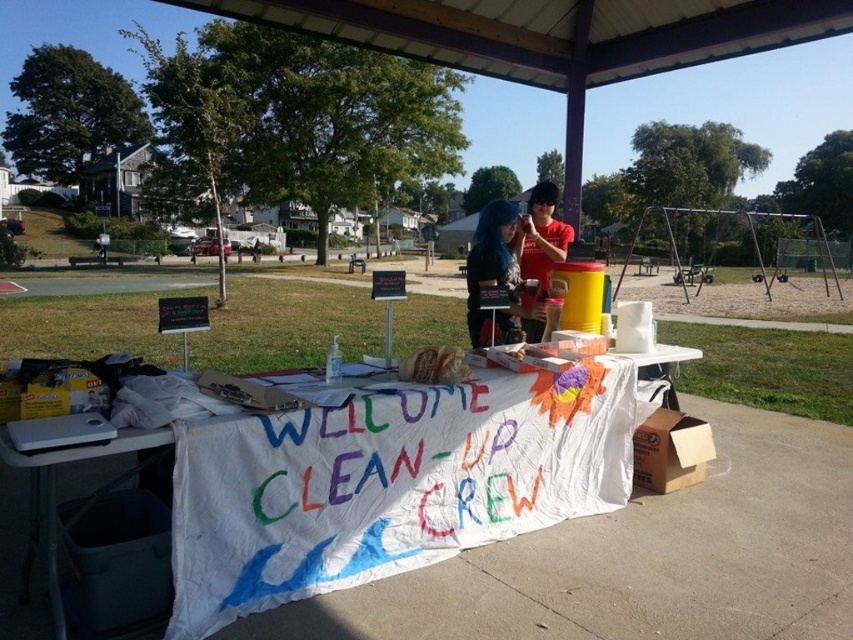
Question: Which point is closer to the camera taking this photo?

Choices:
 (A) (570, 422)
 (B) (483, 236)

Answer: (A)

Question: Is white cloth banner at center wider than shiny blue hair at center?

Choices:
 (A) no
 (B) yes

Answer: (B)

Question: Is white cloth banner at center smaller than shiny blue hair at center?

Choices:
 (A) no
 (B) yes

Answer: (B)

Question: Among these points, which one is farthest from the camera?

Choices:
 (A) 177,496
 (B) 515,336

Answer: (B)

Question: Is white cloth banner at center positioned before shiny blue hair at center?

Choices:
 (A) no
 (B) yes

Answer: (B)